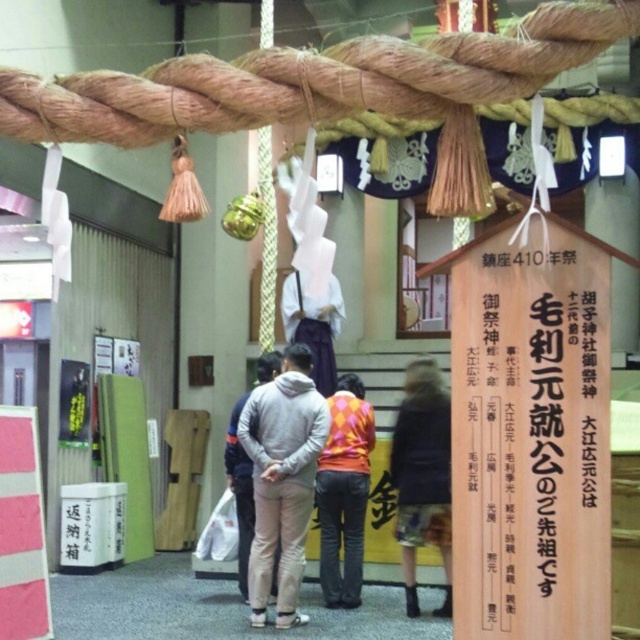
You are an exhibit visitor wearing a gray fleece sweatshirt at center and a dark blue fabric skirt at lower center. You want to take a photo of the Shimenawa rope above you. Can you see the Shimenawa rope through your sweatshirt and skirt?

The gray fleece sweatshirt at center is positioned over dark blue fabric skirt at lower center, but this does not block your view of the Shimenawa rope above. You can still see the Shimenawa rope through your clothing.

You are an anthropologist examining the exhibit and notice the dark blue fabric skirt at lower center and the gray fleece jacket at center. Which of these items is smaller in size?

The dark blue fabric skirt at lower center is smaller than the gray fleece jacket at center.